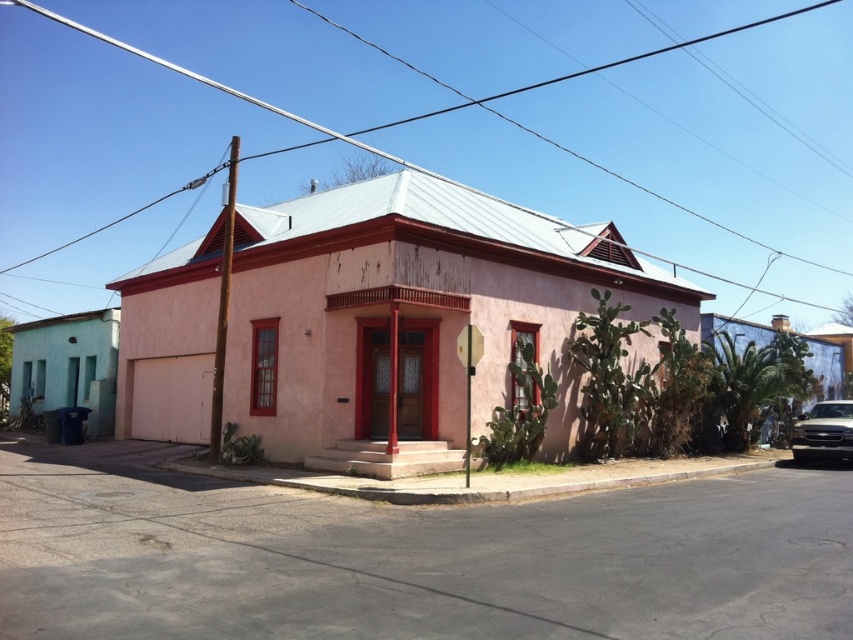
Question: Does metallic wire at upper center have a lesser width compared to gold metallic car at lower right?

Choices:
 (A) no
 (B) yes

Answer: (A)

Question: Which of the following is the farthest from the observer?

Choices:
 (A) metallic wire at upper center
 (B) gold metallic car at lower right
 (C) gray concrete curb at lower center

Answer: (A)

Question: Can you confirm if metallic wire at upper center is positioned to the left of gold metallic car at lower right?

Choices:
 (A) yes
 (B) no

Answer: (A)

Question: Which of the following is the closest to the observer?

Choices:
 (A) gray concrete curb at lower center
 (B) metallic wire at upper center

Answer: (A)

Question: Which point is farther from the camera taking this photo?

Choices:
 (A) (842, 410)
 (B) (691, 141)

Answer: (B)

Question: From the image, what is the correct spatial relationship of metallic wire at upper center in relation to gold metallic car at lower right?

Choices:
 (A) left
 (B) right

Answer: (A)